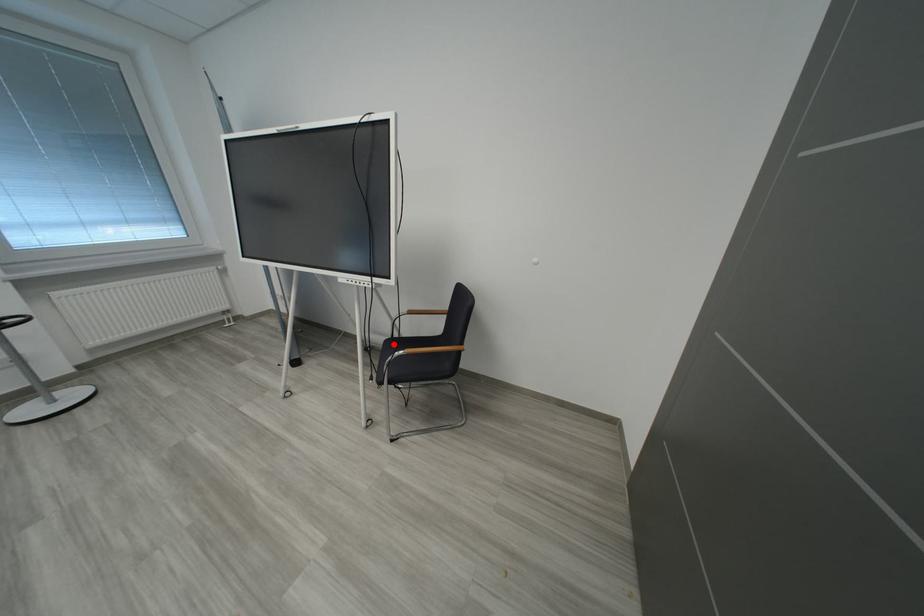
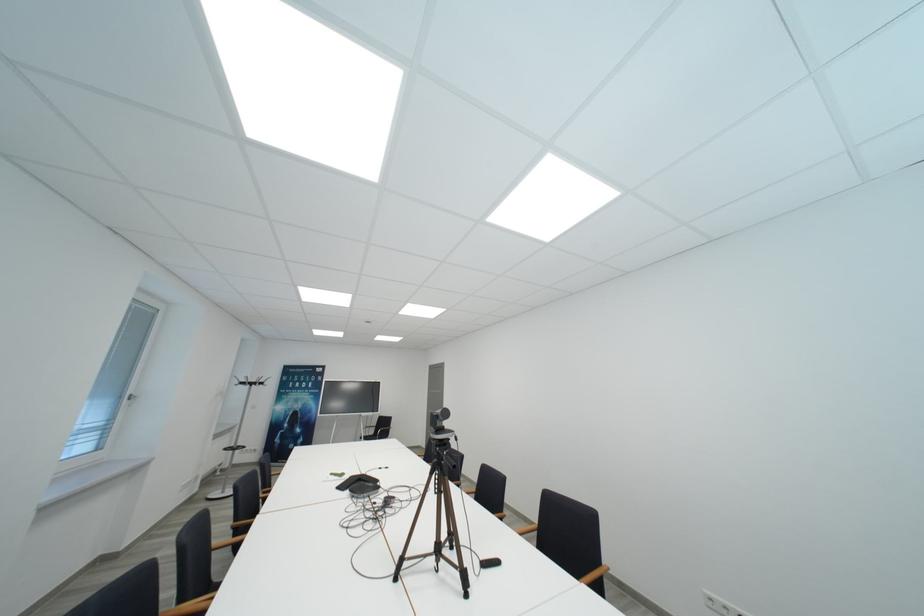
Question: I am providing you with two images of the same scene from different viewpoints. A red point is marked on the first image. Can you still see the location of the red point in image 2?

Choices:
 (A) Yes
 (B) No

Answer: (B)